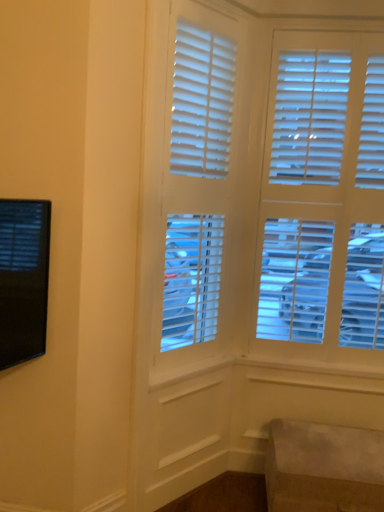
Where is `suede-like beige ottoman at lower right`? suede-like beige ottoman at lower right is located at coordinates (323, 468).

The image size is (384, 512). Describe the element at coordinates (323, 468) in the screenshot. I see `suede-like beige ottoman at lower right` at that location.

The height and width of the screenshot is (512, 384). Describe the element at coordinates (193, 190) in the screenshot. I see `white matte blinds at center` at that location.

Identify the location of white matte blinds at center. The height and width of the screenshot is (512, 384). (193, 190).

Where is `suede-like beige ottoman at lower right`? suede-like beige ottoman at lower right is located at coordinates (323, 468).

Can you confirm if suede-like beige ottoman at lower right is positioned to the left of white matte blinds at center?

In fact, suede-like beige ottoman at lower right is to the right of white matte blinds at center.

Between suede-like beige ottoman at lower right and white matte blinds at center, which one is positioned in front?

white matte blinds at center.

Considering the positions of points (313, 500) and (157, 289), is point (313, 500) farther from camera compared to point (157, 289)?

No, (313, 500) is closer to viewer.

Consider the image. From the image's perspective, is suede-like beige ottoman at lower right beneath white matte blinds at center?

Correct, suede-like beige ottoman at lower right appears lower than white matte blinds at center in the image.

From a real-world perspective, which object rests below the other?

In real-world perspective, suede-like beige ottoman at lower right is lower.

Does suede-like beige ottoman at lower right have a lesser width compared to white matte blinds at center?

No.

Does suede-like beige ottoman at lower right have a lesser height compared to white matte blinds at center?

Yes.

Considering the relative sizes of suede-like beige ottoman at lower right and white matte blinds at center in the image provided, is suede-like beige ottoman at lower right smaller than white matte blinds at center?

Yes, suede-like beige ottoman at lower right is smaller than white matte blinds at center.

Is suede-like beige ottoman at lower right positioned beyond the bounds of white matte blinds at center?

Yes.

Are suede-like beige ottoman at lower right and white matte blinds at center far apart?

That's right, there is a large distance between suede-like beige ottoman at lower right and white matte blinds at center.

Is suede-like beige ottoman at lower right oriented towards white matte blinds at center?

No.

Locate an element on the screen. furniture located underneath the white matte blinds at center (from a real-world perspective) is located at coordinates (323, 468).

Can you confirm if white matte blinds at center is positioned to the left of suede-like beige ottoman at lower right?

Correct, you'll find white matte blinds at center to the left of suede-like beige ottoman at lower right.

Is white matte blinds at center closer to camera compared to suede-like beige ottoman at lower right?

Yes, the depth of white matte blinds at center is less than that of suede-like beige ottoman at lower right.

Does point (242, 78) appear closer or farther from the camera than point (323, 428)?

Point (242, 78) is positioned closer to the camera compared to point (323, 428).

From the image's perspective, is white matte blinds at center on suede-like beige ottoman at lower right?

Correct, white matte blinds at center appears higher than suede-like beige ottoman at lower right in the image.

From a real-world perspective, is white matte blinds at center positioned above or below suede-like beige ottoman at lower right?

From a real-world perspective, white matte blinds at center is physically above suede-like beige ottoman at lower right.

Can you confirm if white matte blinds at center is wider than suede-like beige ottoman at lower right?

In fact, white matte blinds at center might be narrower than suede-like beige ottoman at lower right.

Considering the sizes of white matte blinds at center and suede-like beige ottoman at lower right in the image, is white matte blinds at center taller or shorter than suede-like beige ottoman at lower right?

In the image, white matte blinds at center appears to be taller than suede-like beige ottoman at lower right.

Who is bigger, white matte blinds at center or suede-like beige ottoman at lower right?

Bigger between the two is white matte blinds at center.

Consider the image. Is suede-like beige ottoman at lower right completely or partially inside white matte blinds at center?

Definitely not — suede-like beige ottoman at lower right is not inside white matte blinds at center.

Would you consider white matte blinds at center to be distant from suede-like beige ottoman at lower right?

Yes.

Is white matte blinds at center turned away from suede-like beige ottoman at lower right?

white matte blinds at center is not turned away from suede-like beige ottoman at lower right.

How many degrees apart are the facing directions of white matte blinds at center and suede-like beige ottoman at lower right?

The facing directions of white matte blinds at center and suede-like beige ottoman at lower right are 48.4 degrees apart.

You are a GUI agent. You are given a task and a screenshot of the screen. Output one action in this format:
    pyautogui.click(x=<x>, y=<y>)
    Task: Click on the window located above the suede-like beige ottoman at lower right (from a real-world perspective)
    This screenshot has height=512, width=384.
    Given the screenshot: What is the action you would take?
    pyautogui.click(x=193, y=190)

Where is `window in front of the suede-like beige ottoman at lower right`? window in front of the suede-like beige ottoman at lower right is located at coordinates (193, 190).

The width and height of the screenshot is (384, 512). I want to click on window that appears on the left of suede-like beige ottoman at lower right, so click(x=193, y=190).